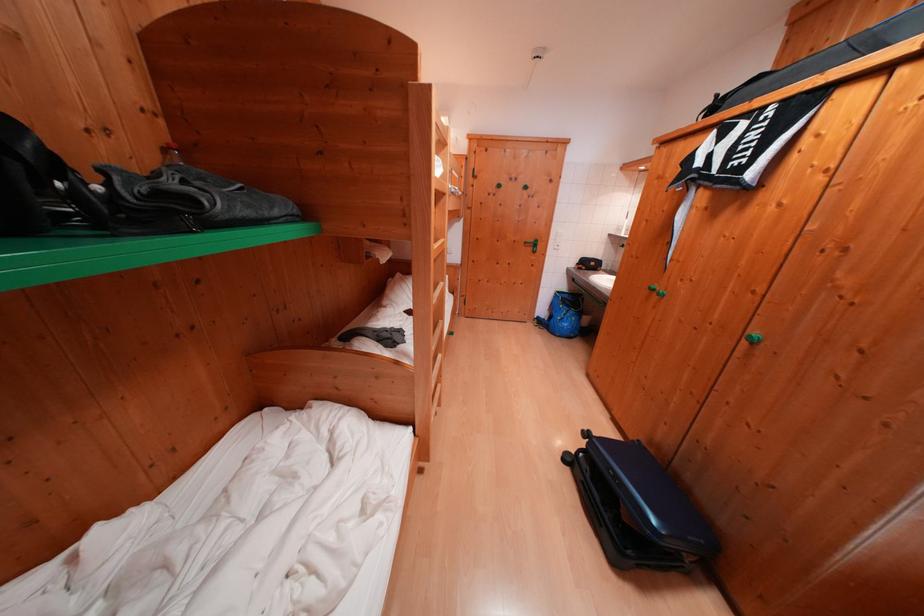
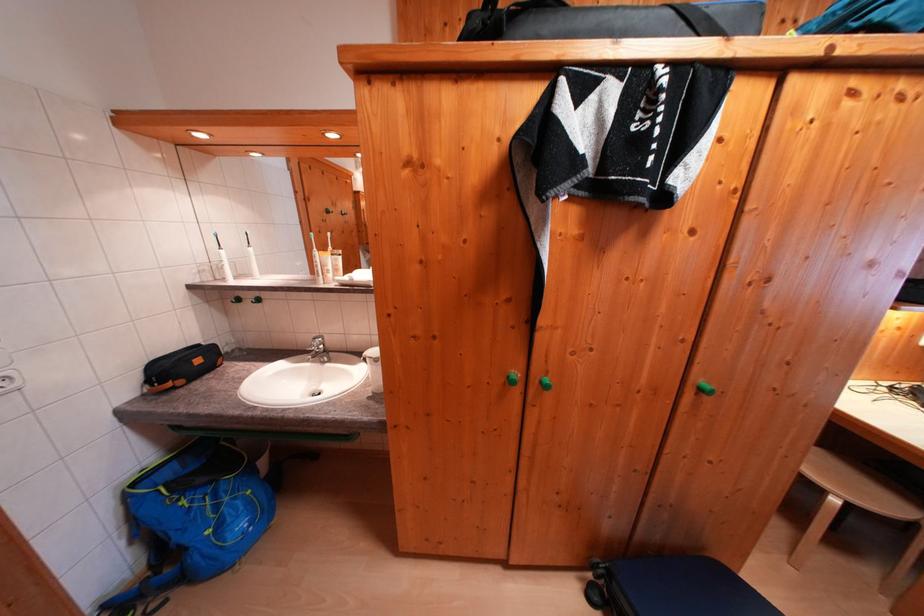
Where in the second image is the point corresponding to (565,296) from the first image?

(142, 488)